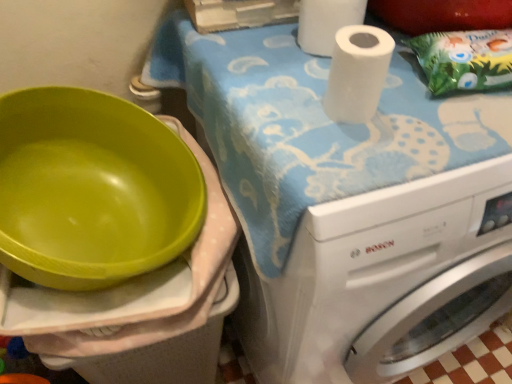
Image resolution: width=512 pixels, height=384 pixels. I want to click on unoccupied region to the right of white matte paper towel at upper center, the 2th paper towel in the back-to-front sequence, so click(x=435, y=122).